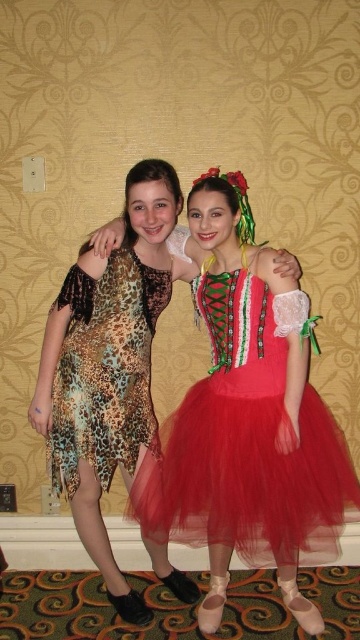
Question: Which object appears farthest from the camera in this image?

Choices:
 (A) red tulle dress at center
 (B) leopard print dress at left

Answer: (B)

Question: Which object is farther from the camera taking this photo?

Choices:
 (A) leopard print dress at left
 (B) leopard print dress at center

Answer: (A)

Question: Which object is positioned closest to the red tulle dress at center?

Choices:
 (A) leopard print dress at center
 (B) leopard print dress at left

Answer: (B)

Question: Does red tulle dress at center have a larger size compared to leopard print dress at center?

Choices:
 (A) no
 (B) yes

Answer: (A)

Question: Is red tulle dress at center further to camera compared to leopard print dress at left?

Choices:
 (A) no
 (B) yes

Answer: (A)

Question: From the image, what is the correct spatial relationship of red tulle dress at center in relation to leopard print dress at left?

Choices:
 (A) right
 (B) left

Answer: (A)